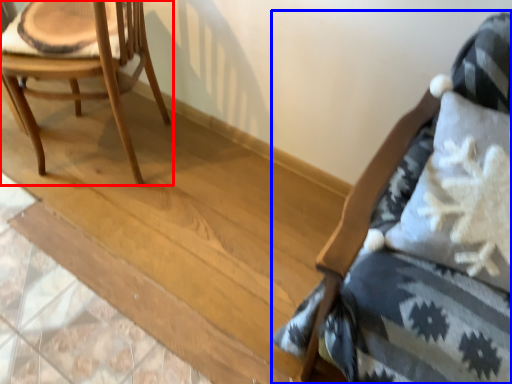
Question: Which object appears closest to the camera in this image, chair (highlighted by a red box) or chair (highlighted by a blue box)?

Choices:
 (A) chair
 (B) chair

Answer: (B)